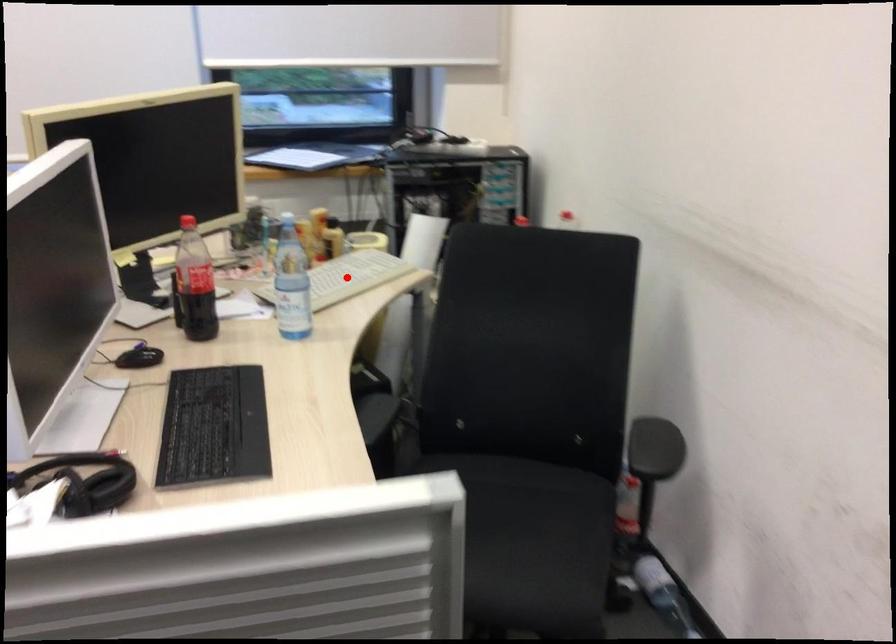
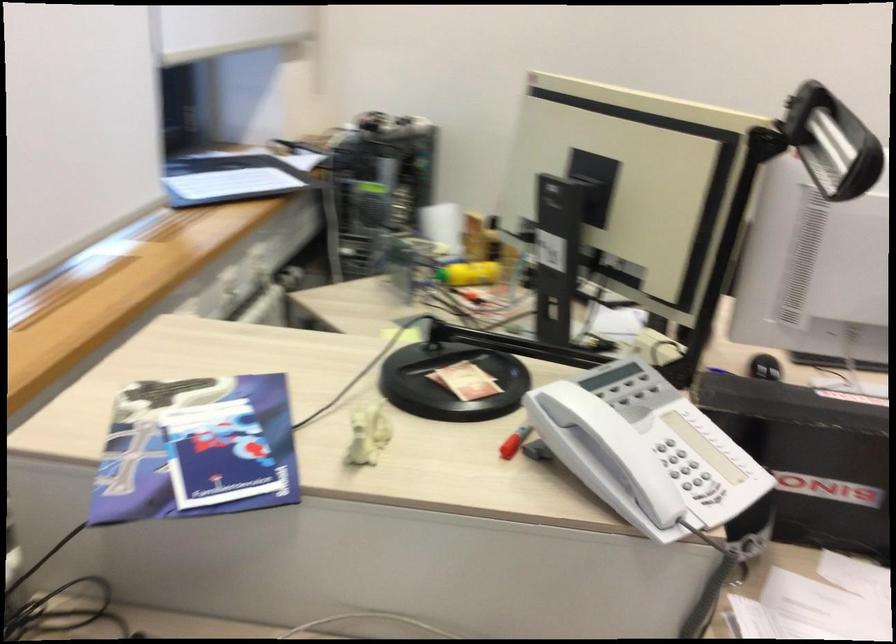
Question: I am providing you with two images of the same scene from different viewpoints. A red point is marked on the first image. Is the red point's position out of view in image 2?

Choices:
 (A) Yes
 (B) No

Answer: (A)